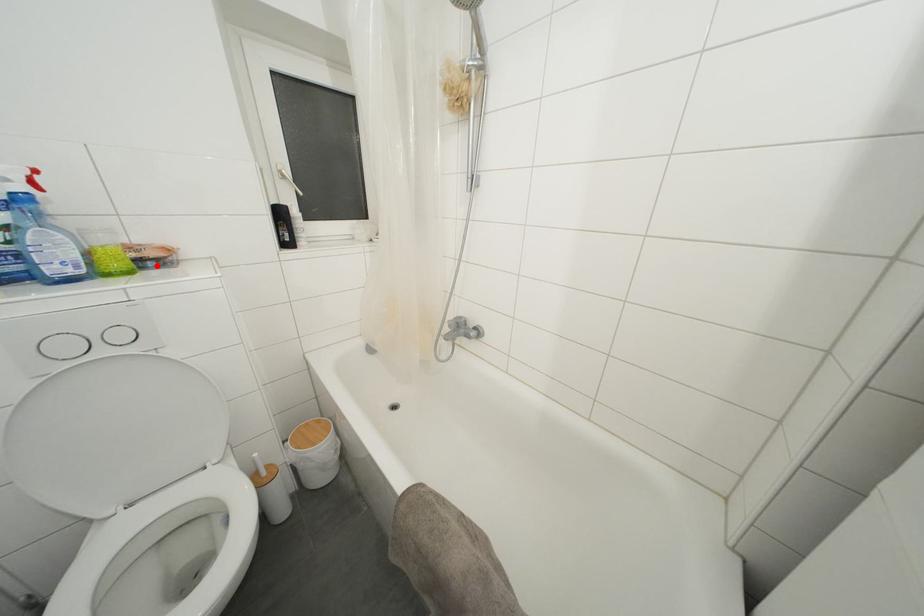
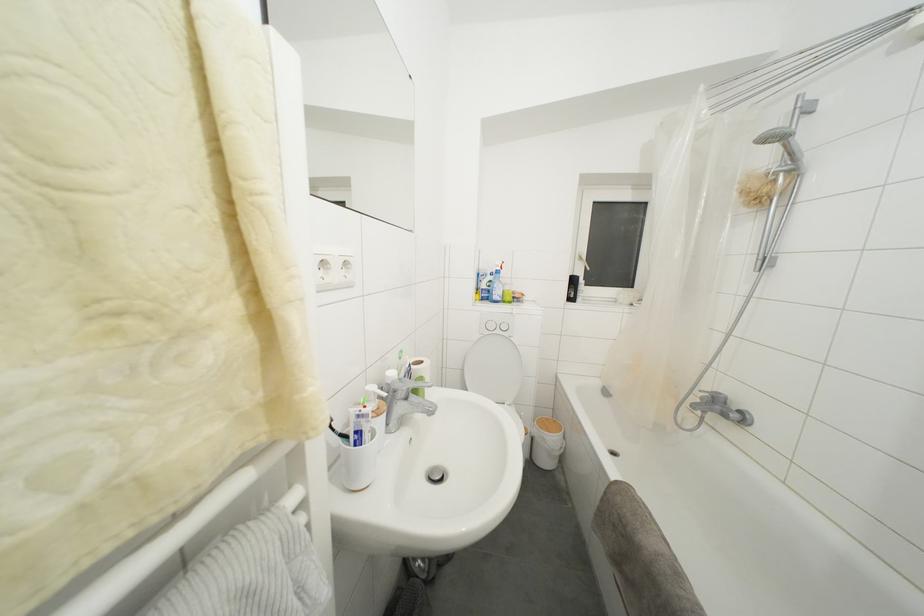
In the second image, find the point that corresponds to the highlighted location in the first image.

(520, 304)